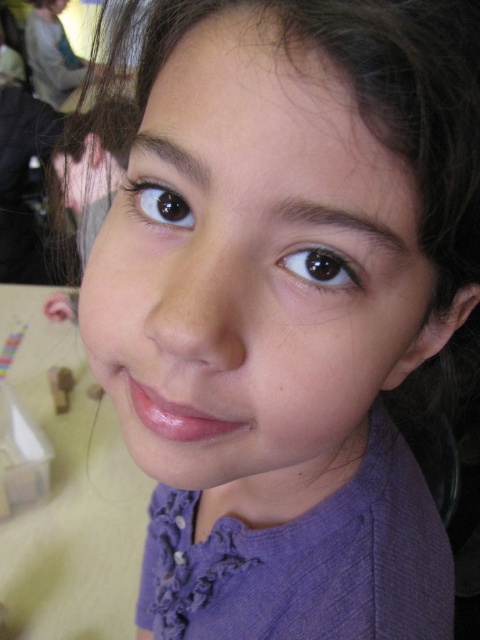
Question: Observing the image, what is the correct spatial positioning of smooth skin face at center in reference to brown glossy eye at upper left?

Choices:
 (A) left
 (B) right

Answer: (B)

Question: Which object is positioned closest to the brown glossy eye at upper center?

Choices:
 (A) brown glossy eye at upper left
 (B) smooth skin face at center

Answer: (A)

Question: Among these points, which one is nearest to the camera?

Choices:
 (A) (178, 212)
 (B) (310, 252)

Answer: (B)

Question: Is smooth skin face at center below brown glossy eye at upper left?

Choices:
 (A) no
 (B) yes

Answer: (B)

Question: Does smooth skin face at center have a larger size compared to brown glossy eye at upper left?

Choices:
 (A) no
 (B) yes

Answer: (B)

Question: Among these points, which one is farthest from the camera?

Choices:
 (A) (304, 275)
 (B) (414, 260)
 (C) (128, 188)

Answer: (C)